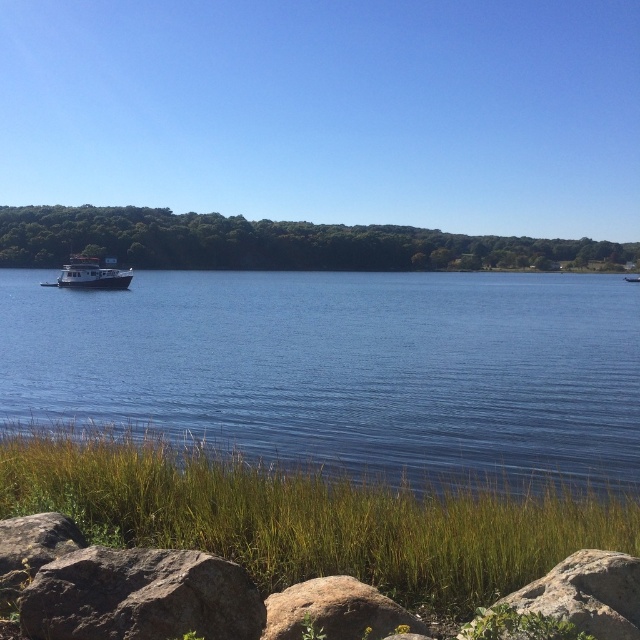
Question: Which object appears farthest from the camera in this image?

Choices:
 (A) gray rock at lower right
 (B) white glossy houseboat at left

Answer: (B)

Question: Is brown rough rock at lower left positioned behind white glossy houseboat at left?

Choices:
 (A) no
 (B) yes

Answer: (A)

Question: Among these objects, which one is farthest from the camera?

Choices:
 (A) gray rock at lower right
 (B) white glossy houseboat at left
 (C) blue water at center

Answer: (B)

Question: Estimate the real-world distances between objects in this image. Which object is closer to the smooth gray rock at lower left?

Choices:
 (A) blue water at center
 (B) gray rock at lower right
 (C) brown rough rock at lower center

Answer: (C)

Question: Does brown rough rock at lower left have a lesser width compared to brown rough rock at lower center?

Choices:
 (A) yes
 (B) no

Answer: (B)

Question: Is brown rough rock at lower left wider than gray rock at lower right?

Choices:
 (A) yes
 (B) no

Answer: (A)